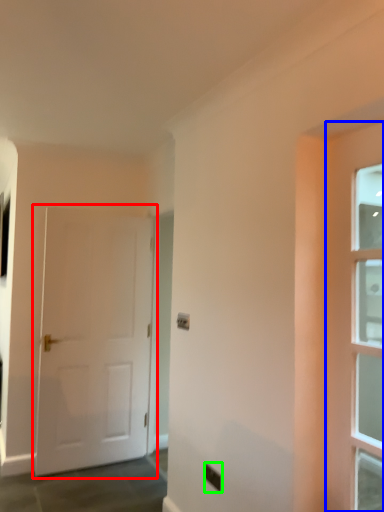
Question: Considering the real-world distances, which object is farthest from door (highlighted by a red box)? door (highlighted by a blue box) or electric outlet (highlighted by a green box)?

Choices:
 (A) door
 (B) electric outlet

Answer: (A)